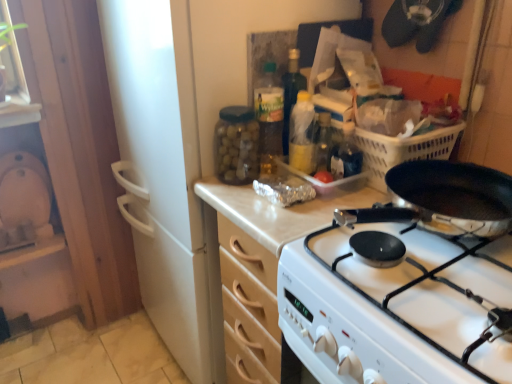
This screenshot has height=384, width=512. What are the coordinates of `free location in front of transparent glass jar at upper center, which is the first bottle from left to right` in the screenshot? It's located at (253, 205).